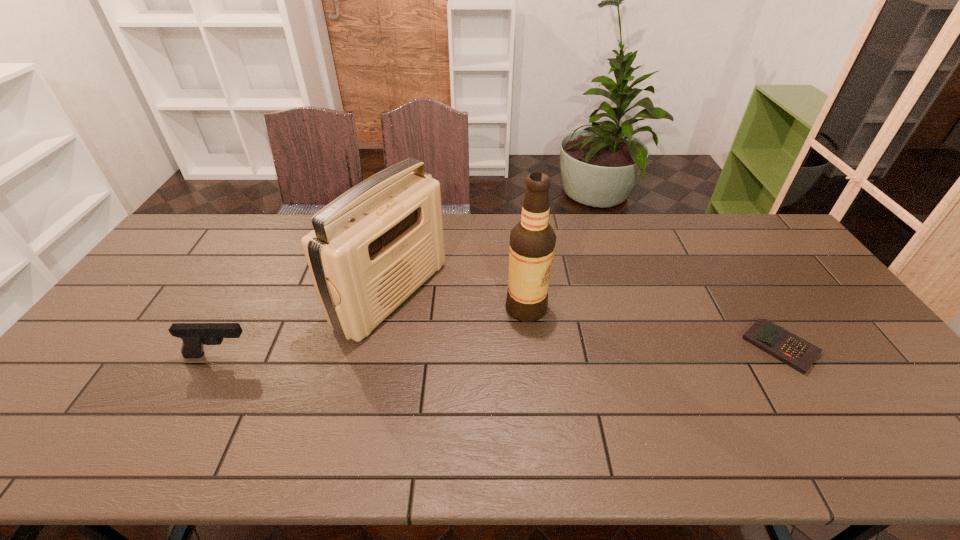
Identify which object is the third closest to the alcohol. Please provide its 2D coordinates. Your answer should be formatted as a tuple, i.e. [(x, y)], where the tuple contains the x and y coordinates of a point satisfying the conditions above.

[(194, 336)]

You are a GUI agent. You are given a task and a screenshot of the screen. Output one action in this format:
    pyautogui.click(x=<x>, y=<y>)
    Task: Click on the object that ranks as the second closest to the radio receiver
    Image resolution: width=960 pixels, height=540 pixels.
    Given the screenshot: What is the action you would take?
    pyautogui.click(x=532, y=241)

Find the location of a particular element. This screenshot has height=540, width=960. vacant space that satisfies the following two spatial constraints: 1. on the front side of the calculator; 2. on the left side of the third object from left to right is located at coordinates (530, 347).

You are a GUI agent. You are given a task and a screenshot of the screen. Output one action in this format:
    pyautogui.click(x=<x>, y=<y>)
    Task: Click on the vacant region that satisfies the following two spatial constraints: 1. on the front side of the third object from right to left; 2. on the left side of the shortest object
    
    Given the screenshot: What is the action you would take?
    pyautogui.click(x=380, y=347)